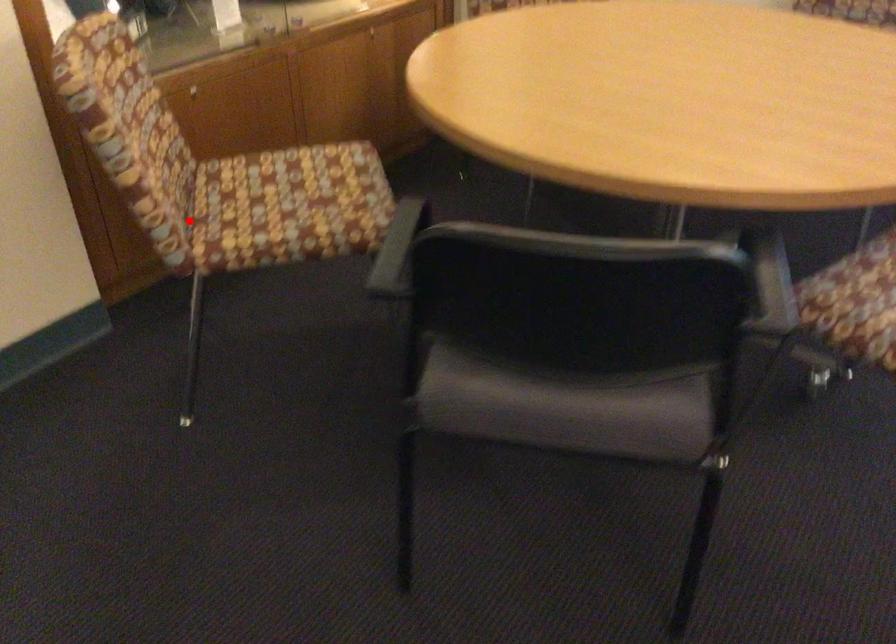
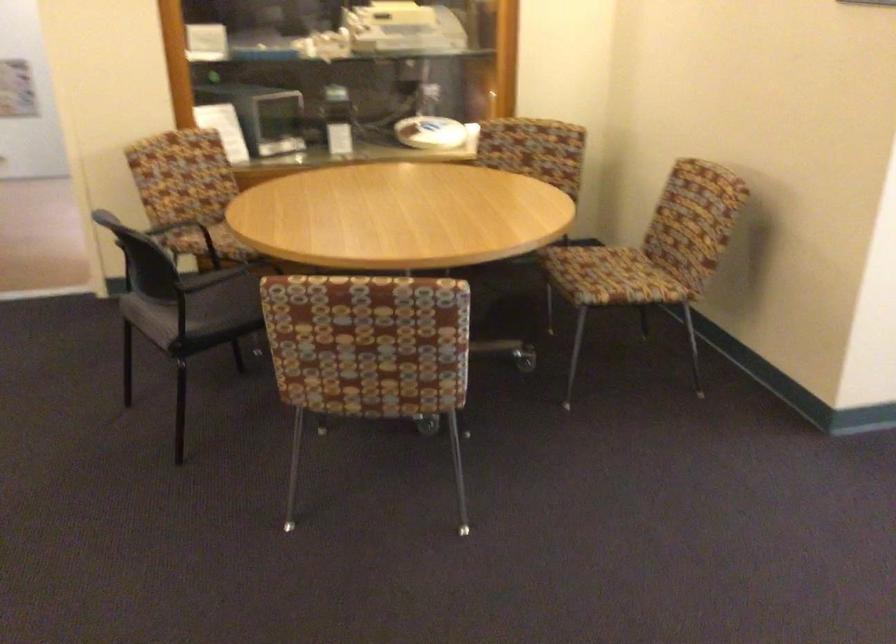
Find the pixel in the second image that matches the highlighted location in the first image.

(167, 220)